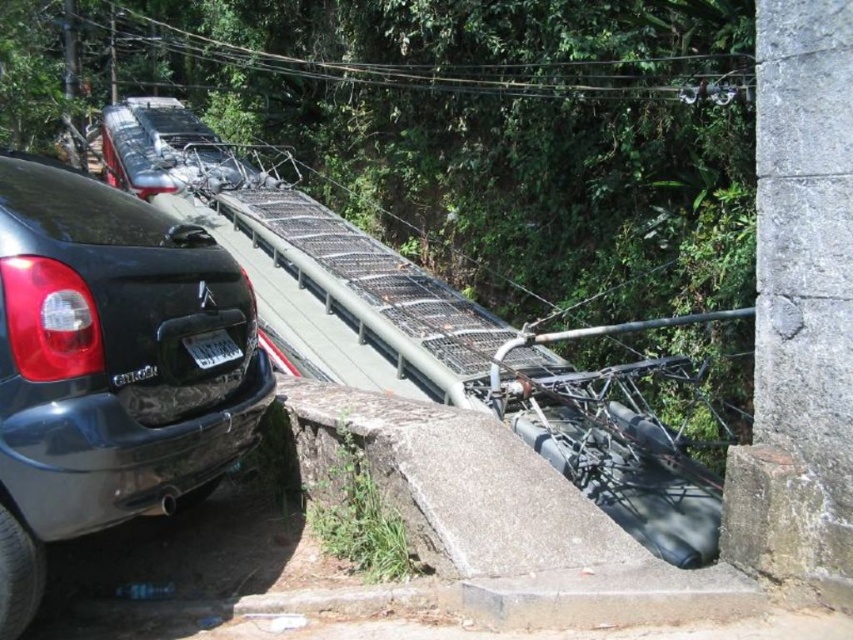
From the picture: You are a delivery driver who needs to transport a large package that requires a vehicle width of at least 2 meters. You see the matte black car at left and the white plastic license plate at center. Which vehicle can accommodate your package?

The matte black car at left has a width larger than the white plastic license plate at center, so it can accommodate the large package requiring at least 2 meters width.

Consider the image. You are a pedestrian standing near the railway bridge and want to take a photo of the matte black car at left and the white plastic license plate at center. Which object should you focus on first to ensure both are in the frame?

Since the matte black car at left is closer to the viewer than the white plastic license plate at center, you should focus on the matte black car at left first to ensure both are in the frame.